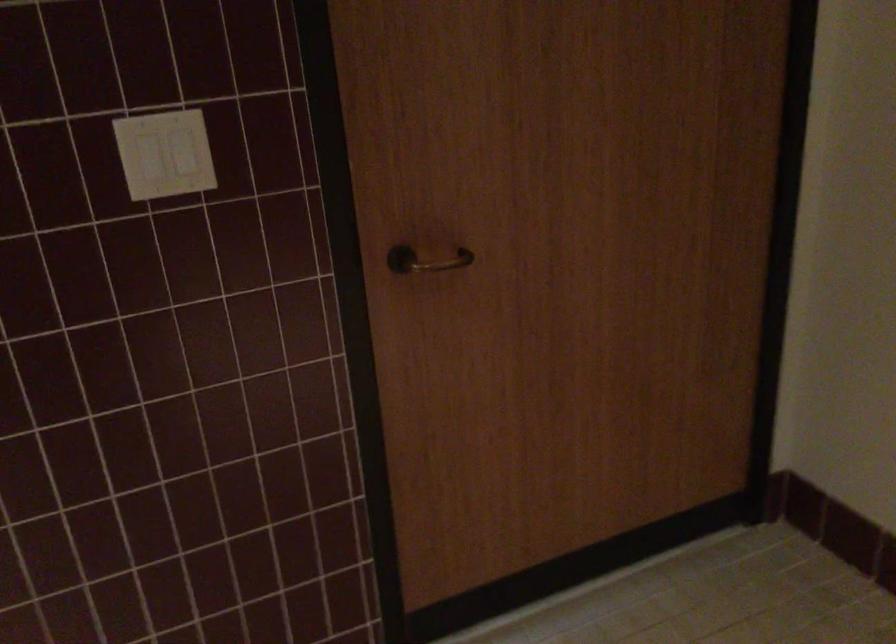
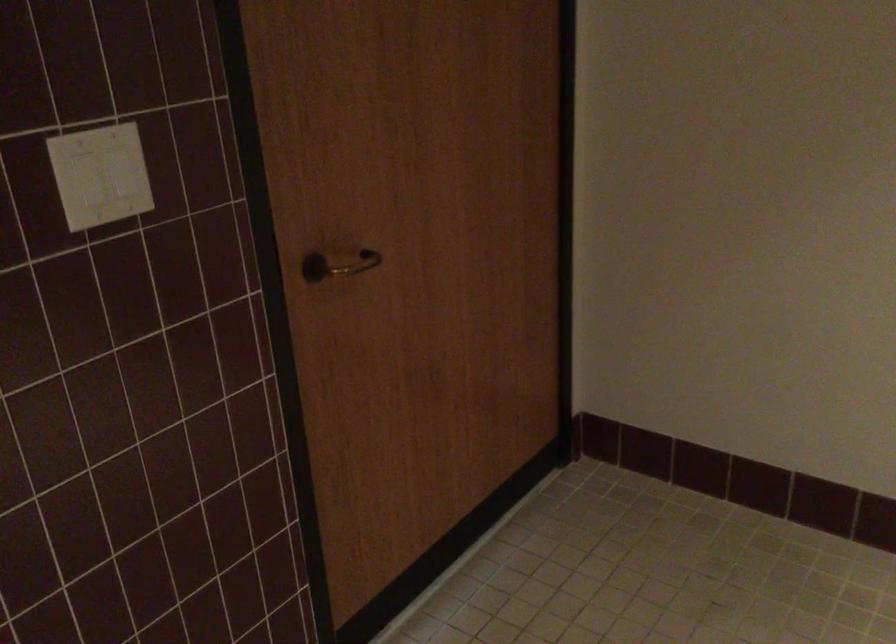
Find the pixel in the second image that matches point 433,258 in the first image.

(338, 265)